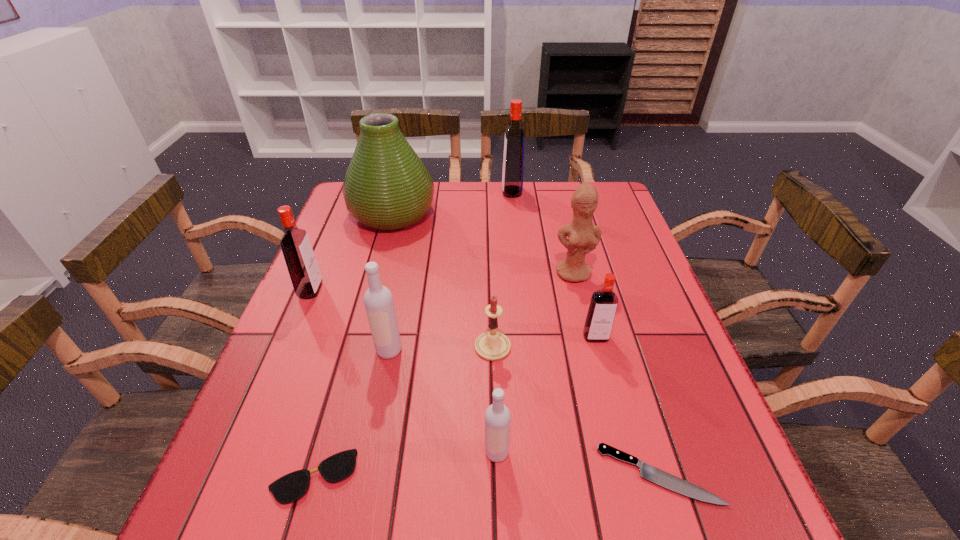
Where is `vacant space that's between the green vase and the nearest vodka`? The width and height of the screenshot is (960, 540). vacant space that's between the green vase and the nearest vodka is located at coordinates (444, 333).

You are a GUI agent. You are given a task and a screenshot of the screen. Output one action in this format:
    pyautogui.click(x=<x>, y=<y>)
    Task: Click on the unoccupied area between the green vase and the nearest vodka
    The width and height of the screenshot is (960, 540).
    Given the screenshot: What is the action you would take?
    pyautogui.click(x=444, y=333)

Locate an element on the screen. The height and width of the screenshot is (540, 960). unoccupied area between the candle and the fourth vodka from left to right is located at coordinates (502, 269).

This screenshot has width=960, height=540. What are the coordinates of `free space between the second vodka from left to right and the figurine` in the screenshot? It's located at (481, 312).

Where is `vacant area between the second biggest red vodka and the steak knife`? The height and width of the screenshot is (540, 960). vacant area between the second biggest red vodka and the steak knife is located at coordinates (485, 382).

Where is `empty space between the vase and the fourth vodka from right to left`? empty space between the vase and the fourth vodka from right to left is located at coordinates (391, 282).

This screenshot has width=960, height=540. Find the location of `free space between the figurine and the second biggest red vodka`. free space between the figurine and the second biggest red vodka is located at coordinates (443, 281).

In order to click on the eighth closest object to the green vase in this screenshot , I will do `click(497, 416)`.

Locate an element on the screen. This screenshot has height=540, width=960. the sixth closest object to the figurine is located at coordinates click(x=648, y=472).

Identify which vodka is the fourth nearest to the second biggest red vodka. Please provide its 2D coordinates. Your answer should be formatted as a tuple, i.e. [(x, y)], where the tuple contains the x and y coordinates of a point satisfying the conditions above.

[(601, 313)]